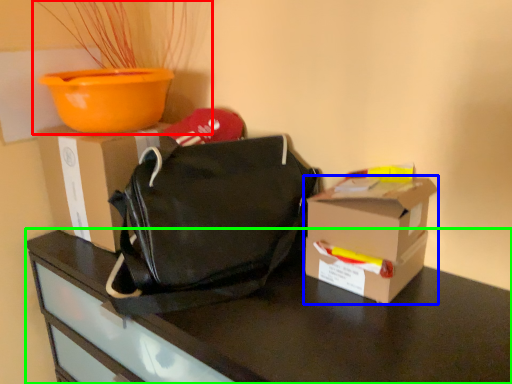
Question: Which is farther away from houseplant (highlighted by a red box)? box (highlighted by a blue box) or desk (highlighted by a green box)?

Choices:
 (A) box
 (B) desk

Answer: (A)